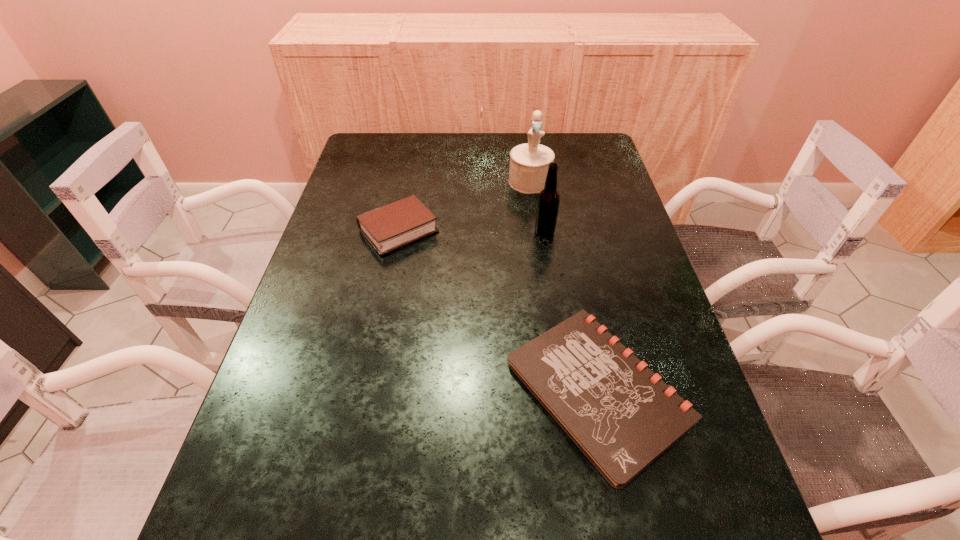
Identify the location of object at the far edge. (529, 162).

The height and width of the screenshot is (540, 960). I want to click on object that is at the left edge, so click(x=394, y=225).

Locate an element on the screen. The height and width of the screenshot is (540, 960). object located at the right edge is located at coordinates (620, 414).

What are the coordinates of `vacant space at the left edge` in the screenshot? It's located at (377, 182).

Locate an element on the screen. Image resolution: width=960 pixels, height=540 pixels. free region at the right edge of the desktop is located at coordinates (718, 475).

Where is `free region at the far left corner`? This screenshot has height=540, width=960. free region at the far left corner is located at coordinates (381, 138).

Find the location of a particular element. Image resolution: width=960 pixels, height=540 pixels. empty space between the second shortest object and the beer bottle is located at coordinates click(x=471, y=231).

The image size is (960, 540). Find the location of `unoccupied position between the third tallest object and the notebook`. unoccupied position between the third tallest object and the notebook is located at coordinates (498, 310).

Find the location of a particular element. empty location between the third tallest object and the beer bottle is located at coordinates (471, 231).

Find the location of a particular element. The height and width of the screenshot is (540, 960). free space between the leftmost object and the beer bottle is located at coordinates (471, 231).